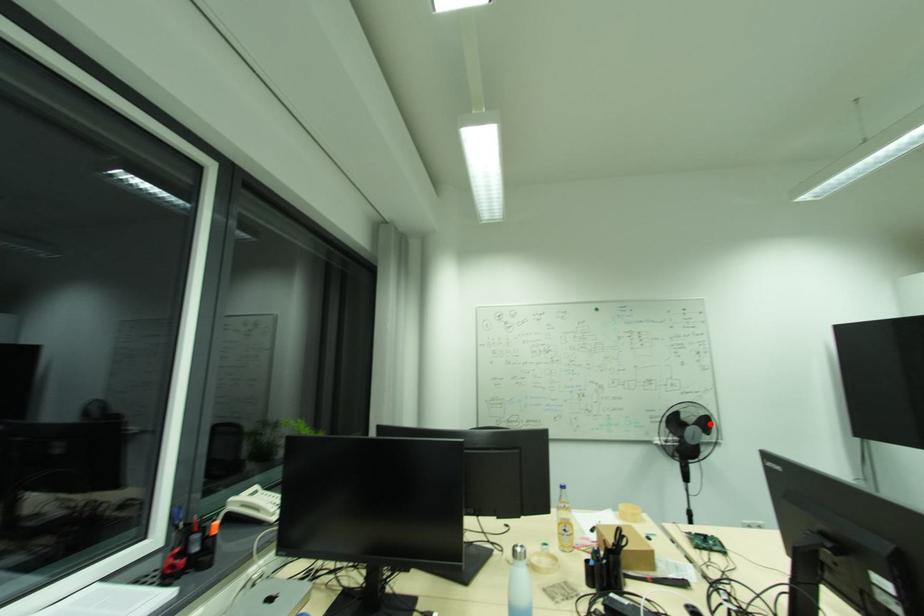
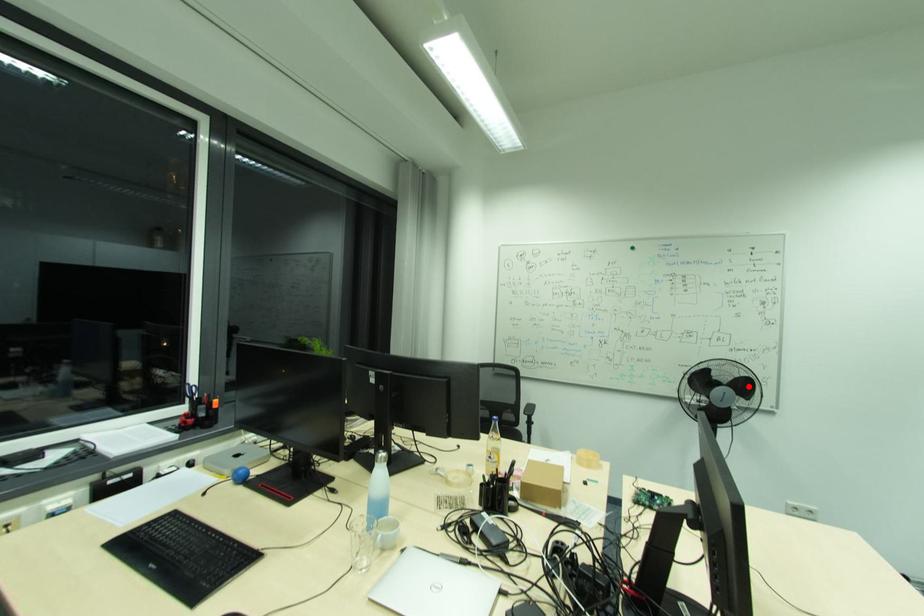
I am providing you with two images of the same scene from different viewpoints. A red point is marked on the first image and another point is marked on the second image. Is the marked point in image1 the same physical position as the marked point in image2?

Yes